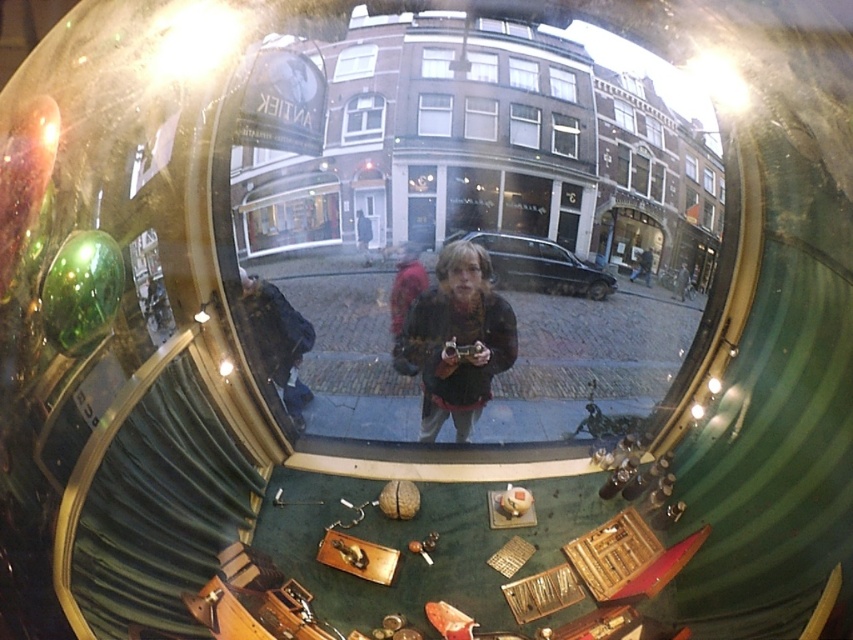
Can you confirm if matte black jacket at center is thinner than dark blue jacket at center?

In fact, matte black jacket at center might be wider than dark blue jacket at center.

Is point (398, 339) closer to viewer compared to point (291, 406)?

Yes.

Locate an element on the screen. The image size is (853, 640). matte black jacket at center is located at coordinates (456, 340).

Between matte black camera at center and dark blue jacket at center, which one is positioned higher?

Positioned higher is matte black camera at center.

Between matte black camera at center and dark blue jacket at center, which one has more height?

matte black camera at center

The height and width of the screenshot is (640, 853). Find the location of `matte black camera at center`. matte black camera at center is located at coordinates (485, 220).

Who is shorter, matte black camera at center or matte black jacket at center?

matte black jacket at center is shorter.

Does point (479, 113) come behind point (480, 332)?

No, (479, 113) is closer to viewer.

Describe the element at coordinates (485, 220) in the screenshot. I see `matte black camera at center` at that location.

Identify the location of matte black camera at center. This screenshot has width=853, height=640. (485, 220).